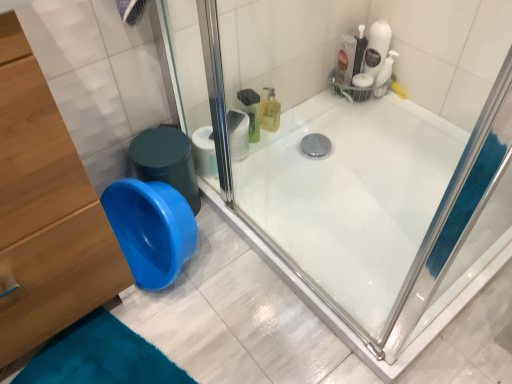
Question: Does wooden dresser at left appear on the right side of white matte toilet paper at upper center?

Choices:
 (A) yes
 (B) no

Answer: (B)

Question: From a real-world perspective, is wooden dresser at left physically below white matte toilet paper at upper center?

Choices:
 (A) yes
 (B) no

Answer: (B)

Question: Is white matte toilet paper at upper center at the back of wooden dresser at left?

Choices:
 (A) yes
 (B) no

Answer: (B)

Question: Is white matte toilet paper at upper center inside wooden dresser at left?

Choices:
 (A) yes
 (B) no

Answer: (B)

Question: Is wooden dresser at left further to camera compared to white matte toilet paper at upper center?

Choices:
 (A) yes
 (B) no

Answer: (B)

Question: From the image's perspective, is wooden dresser at left beneath white matte toilet paper at upper center?

Choices:
 (A) yes
 (B) no

Answer: (A)

Question: Does blue plastic potty at lower left turn towards white matte toilet paper at upper center?

Choices:
 (A) yes
 (B) no

Answer: (B)

Question: From the image's perspective, is blue plastic potty at lower left on top of white matte toilet paper at upper center?

Choices:
 (A) no
 (B) yes

Answer: (A)

Question: Does blue plastic potty at lower left appear on the right side of white matte toilet paper at upper center?

Choices:
 (A) no
 (B) yes

Answer: (A)

Question: Is blue plastic potty at lower left thinner than white matte toilet paper at upper center?

Choices:
 (A) yes
 (B) no

Answer: (B)

Question: From the image's perspective, is blue plastic potty at lower left under white matte toilet paper at upper center?

Choices:
 (A) no
 (B) yes

Answer: (B)

Question: Does blue plastic potty at lower left lie in front of white matte toilet paper at upper center?

Choices:
 (A) yes
 (B) no

Answer: (A)

Question: Is wooden dresser at left shorter than blue plastic potty at lower left?

Choices:
 (A) no
 (B) yes

Answer: (A)